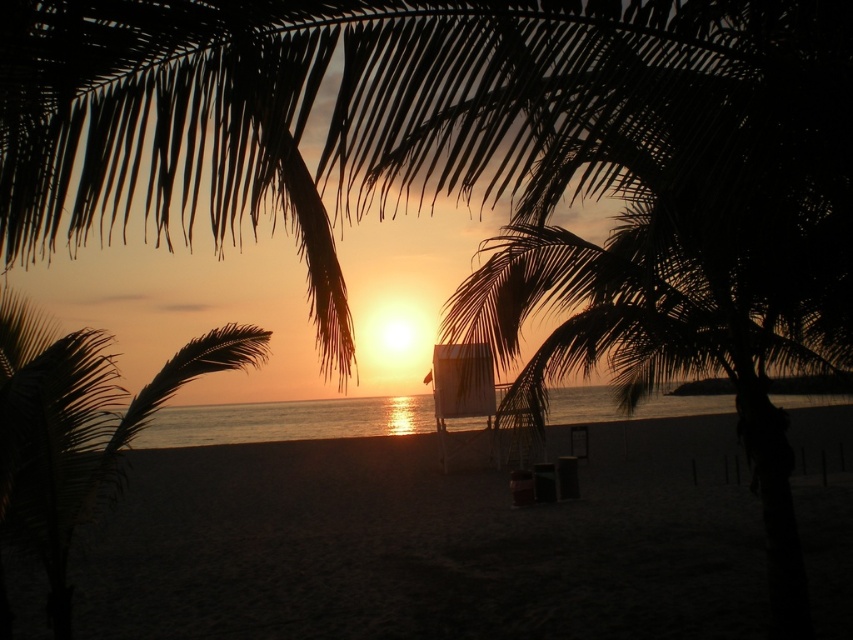
You are standing on the beach and want to walk from the dark sand at center to the dark brown leafy palm tree at lower left. Which direction should you face to walk directly towards it?

You should face towards the lower left direction because the dark brown leafy palm tree at lower left is positioned behind the dark sand at center, meaning it is closer to the viewer. Since the dark sand at center is further away, you need to walk towards the lower left to reach the palm tree.

You are a photographer trying to capture the sunset scene. You notice the dark sand at center and the dark brown leafy palm tree at lower left. Which object would appear bigger in your photo?

The dark sand at center appears bigger in the photo because it has a larger size compared to the dark brown leafy palm tree at lower left.

You are standing on the beach and want to place a small flag exactly at the center of the dark sand at center. According to the coordinates provided, where should you place the flag?

The dark sand at center is located at coordinates point (x=427, y=545), so you should place the flag there.